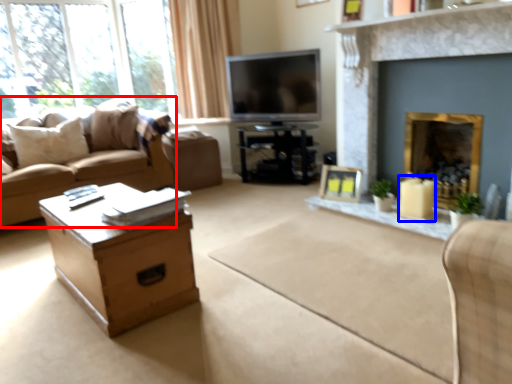
Question: Which of the following is the closest to the observer, studio couch (highlighted by a red box) or candle holder (highlighted by a blue box)?

Choices:
 (A) studio couch
 (B) candle holder

Answer: (B)